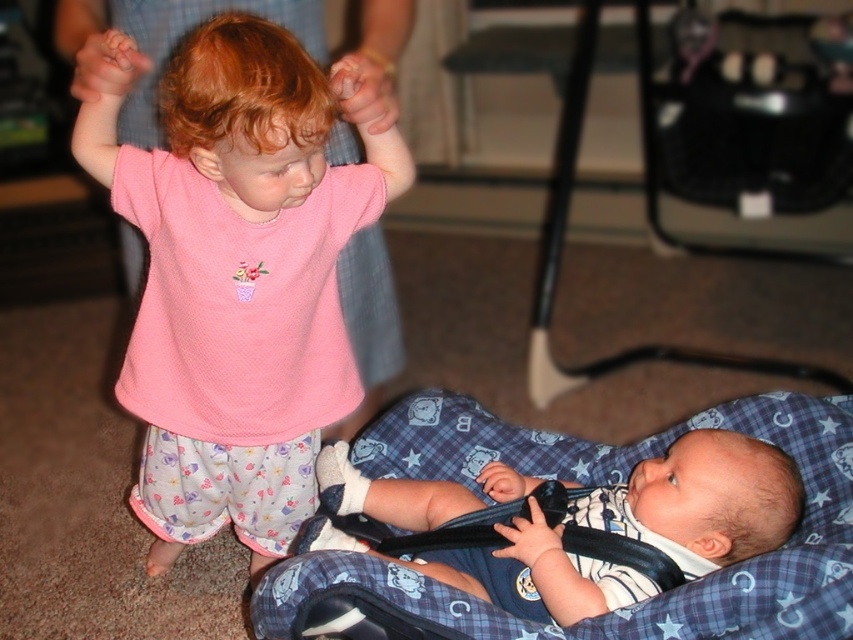
Question: Among these objects, which one is farthest from the camera?

Choices:
 (A) soft blue fabric at center
 (B) pink mesh shirt at upper left

Answer: (A)

Question: Can you confirm if pink mesh shirt at upper left is wider than soft blue fabric at center?

Choices:
 (A) yes
 (B) no

Answer: (B)

Question: Which object is farther from the camera taking this photo?

Choices:
 (A) pink mesh shirt at upper left
 (B) soft blue fabric at center

Answer: (B)

Question: Among these objects, which one is nearest to the camera?

Choices:
 (A) soft blue fabric at center
 (B) pink mesh shirt at upper left

Answer: (B)

Question: Does pink mesh shirt at upper left appear on the left side of soft blue fabric at center?

Choices:
 (A) no
 (B) yes

Answer: (B)

Question: Where is pink mesh shirt at upper left located in relation to soft blue fabric at center in the image?

Choices:
 (A) below
 (B) above

Answer: (B)